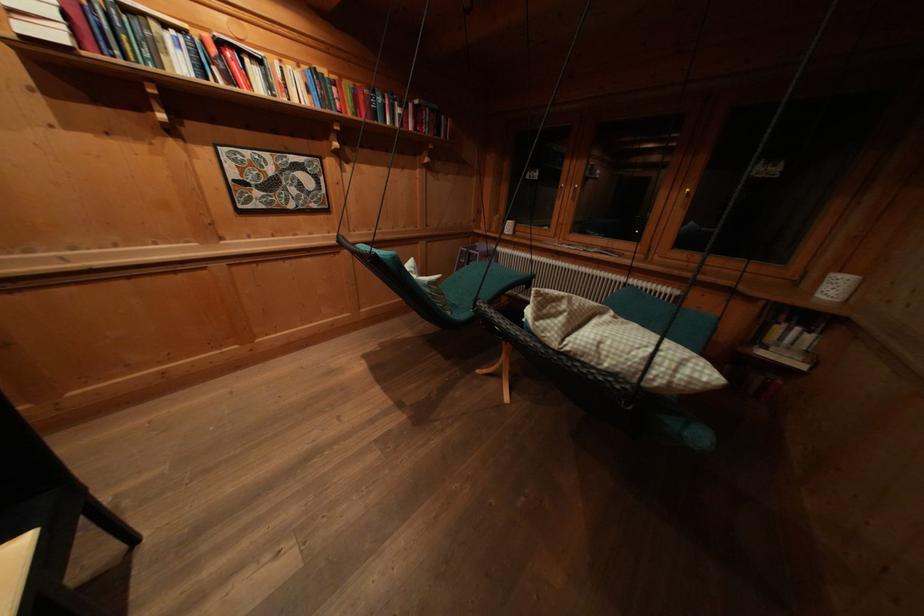
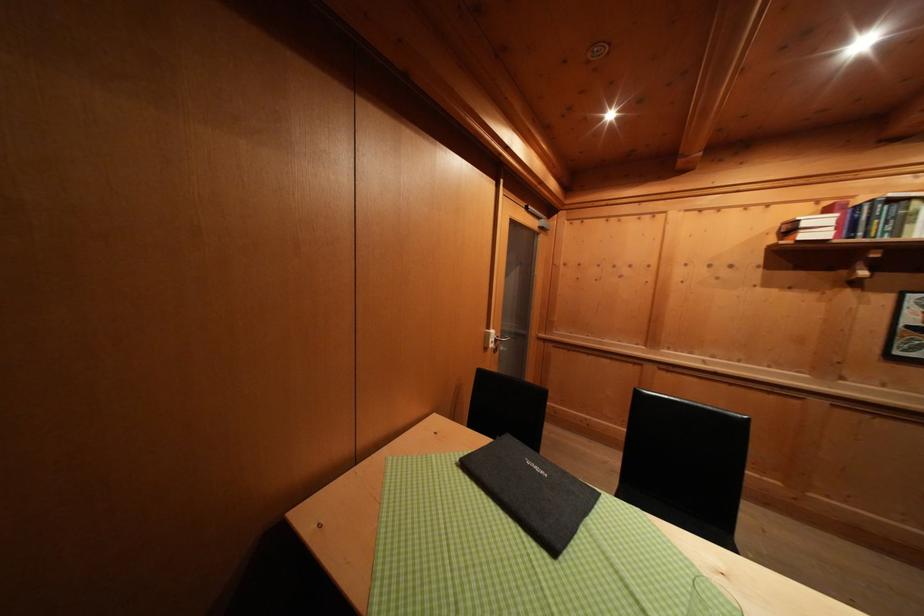
Question: The first image is from the beginning of the video and the second image is from the end. How did the camera likely rotate when shooting the video?

Choices:
 (A) Left
 (B) Right
 (C) Up
 (D) Down

Answer: (A)